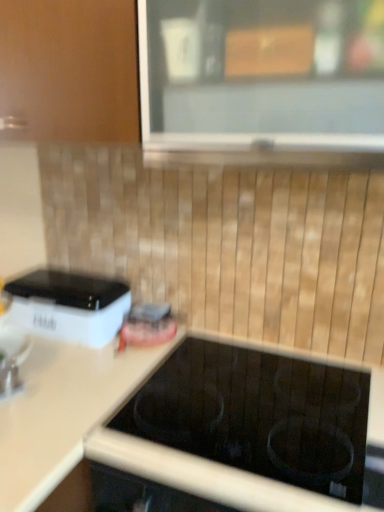
Question: In terms of height, does white matte countertop at center look taller or shorter compared to white plastic toaster at left?

Choices:
 (A) tall
 (B) short

Answer: (A)

Question: Relative to white plastic toaster at left, is white matte countertop at center in front or behind?

Choices:
 (A) behind
 (B) front

Answer: (B)

Question: Considering the real-world distances, which object is closest to the white matte countertop at center?

Choices:
 (A) white plastic toaster at left
 (B) clear glass window at upper center
 (C) metallic faucet at lower left

Answer: (C)

Question: Based on their relative distances, which object is nearer to the white matte countertop at center?

Choices:
 (A) white plastic toaster at left
 (B) clear glass window at upper center
 (C) metallic faucet at lower left

Answer: (C)